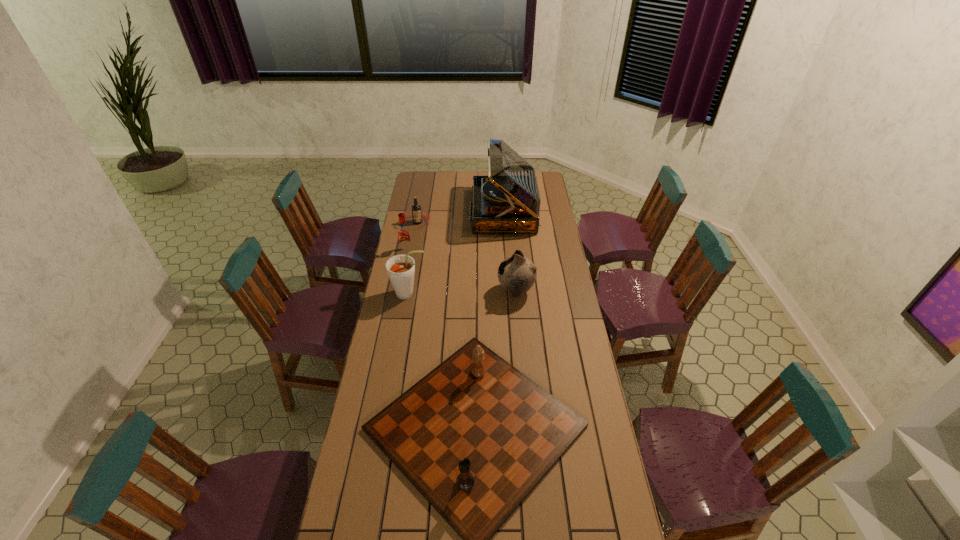
This screenshot has width=960, height=540. Identify the location of free spot between the pottery and the record player. (510, 251).

The image size is (960, 540). I want to click on free space between the shortest root beer and the nearest root beer, so click(x=414, y=258).

You are a GUI agent. You are given a task and a screenshot of the screen. Output one action in this format:
    pyautogui.click(x=<x>, y=<y>)
    Task: Click on the free space between the shortest root beer and the tallest object
    
    Given the screenshot: What is the action you would take?
    pyautogui.click(x=461, y=217)

You are a GUI agent. You are given a task and a screenshot of the screen. Output one action in this format:
    pyautogui.click(x=<x>, y=<y>)
    Task: Click on the unoccupied area between the tallest object and the pottery
    This screenshot has height=540, width=960.
    Given the screenshot: What is the action you would take?
    pyautogui.click(x=510, y=251)

The image size is (960, 540). I want to click on free space between the second farthest root beer and the pottery, so click(461, 271).

Where is `free spot between the nearest root beer and the tallest object`? The width and height of the screenshot is (960, 540). free spot between the nearest root beer and the tallest object is located at coordinates (456, 252).

Where is `free space that is in between the nearest root beer and the shortest root beer`? free space that is in between the nearest root beer and the shortest root beer is located at coordinates (414, 258).

Select which object appears as the fourth closest to the record player. Please provide its 2D coordinates. Your answer should be formatted as a tuple, i.e. [(x, y)], where the tuple contains the x and y coordinates of a point satisfying the conditions above.

[(400, 268)]

Identify which object is the third nearest to the third farthest object. Please provide its 2D coordinates. Your answer should be formatted as a tuple, i.e. [(x, y)], where the tuple contains the x and y coordinates of a point satisfying the conditions above.

[(506, 201)]

Identify the location of the third closest root beer to the tallest object. (x=400, y=268).